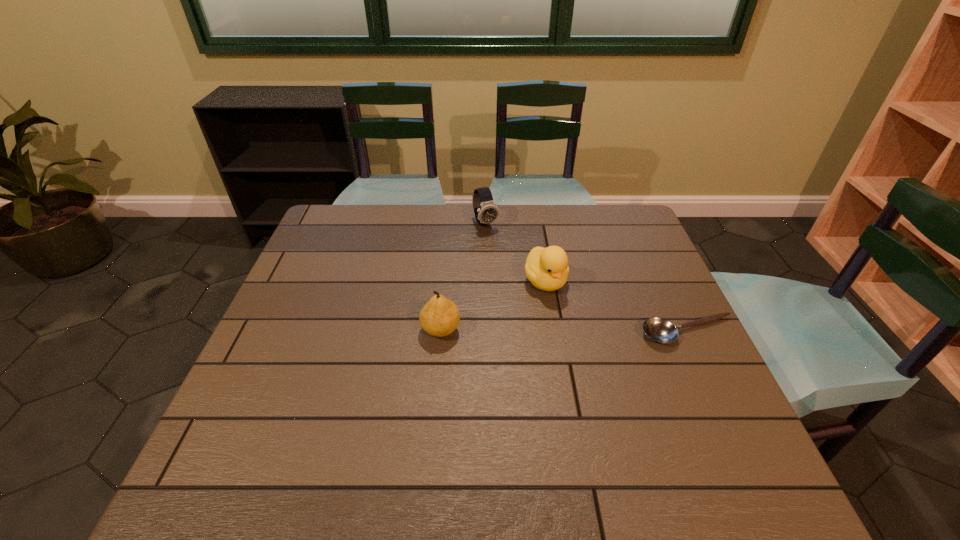
You are a GUI agent. You are given a task and a screenshot of the screen. Output one action in this format:
    pyautogui.click(x=<x>, y=<y>)
    Task: Click on the leftmost object
    
    Given the screenshot: What is the action you would take?
    pyautogui.click(x=440, y=316)

I want to click on the shortest object, so click(660, 330).

Where is `the rightmost object`? the rightmost object is located at coordinates (660, 330).

Identify the location of the farthest object. The width and height of the screenshot is (960, 540). (485, 209).

Identify the location of watch. Image resolution: width=960 pixels, height=540 pixels. (485, 209).

You are a GUI agent. You are given a task and a screenshot of the screen. Output one action in this format:
    pyautogui.click(x=<x>, y=<y>)
    Task: Click on the duck
    This screenshot has height=540, width=960.
    Given the screenshot: What is the action you would take?
    pyautogui.click(x=547, y=269)

Where is `the third object from left to right`? the third object from left to right is located at coordinates (547, 269).

At what (x,y) coordinates should I click in order to perform the action: click on vacant area situated on the right of the pear. Please return your answer as a coordinate pair (x, y). The image size is (960, 540). Looking at the image, I should click on (509, 329).

You are a GUI agent. You are given a task and a screenshot of the screen. Output one action in this format:
    pyautogui.click(x=<x>, y=<y>)
    Task: Click on the vacant space located 0.210m on the back of the shortest object
    The image size is (960, 540).
    Given the screenshot: What is the action you would take?
    pyautogui.click(x=657, y=265)

Where is `vacant area situated on the face of the farthest object`? This screenshot has height=540, width=960. vacant area situated on the face of the farthest object is located at coordinates (540, 315).